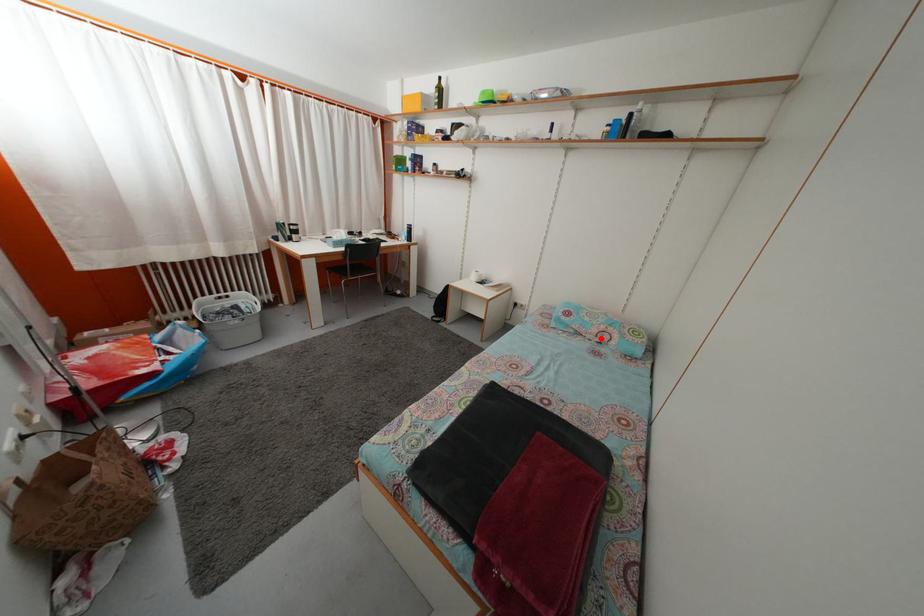
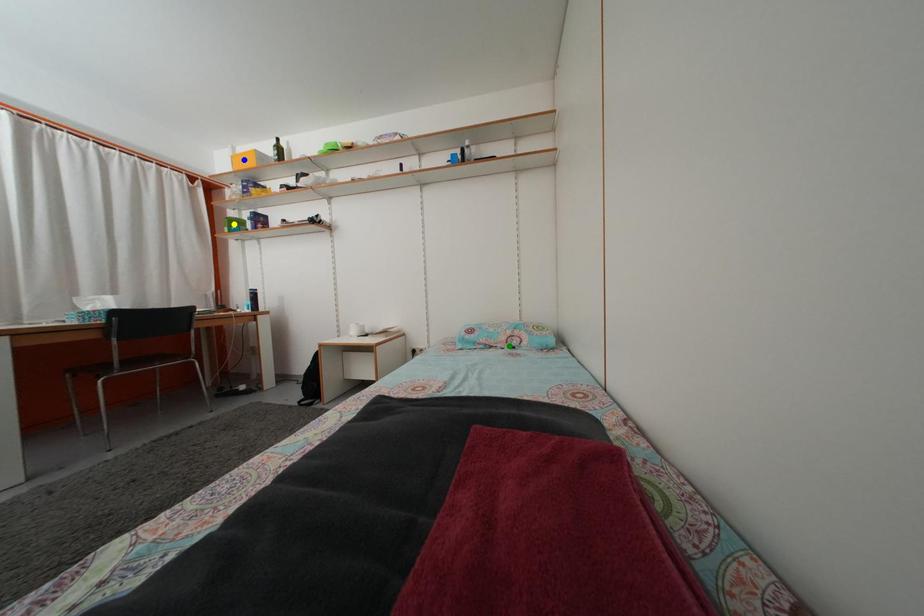
Question: I am providing you with two images of the same scene from different viewpoints. A red point is marked on the first image. You are given multiple points on the second image. Which point in image 2 represents the same 3d spot as the red point in image 1?

Choices:
 (A) green point
 (B) yellow point
 (C) blue point

Answer: (A)